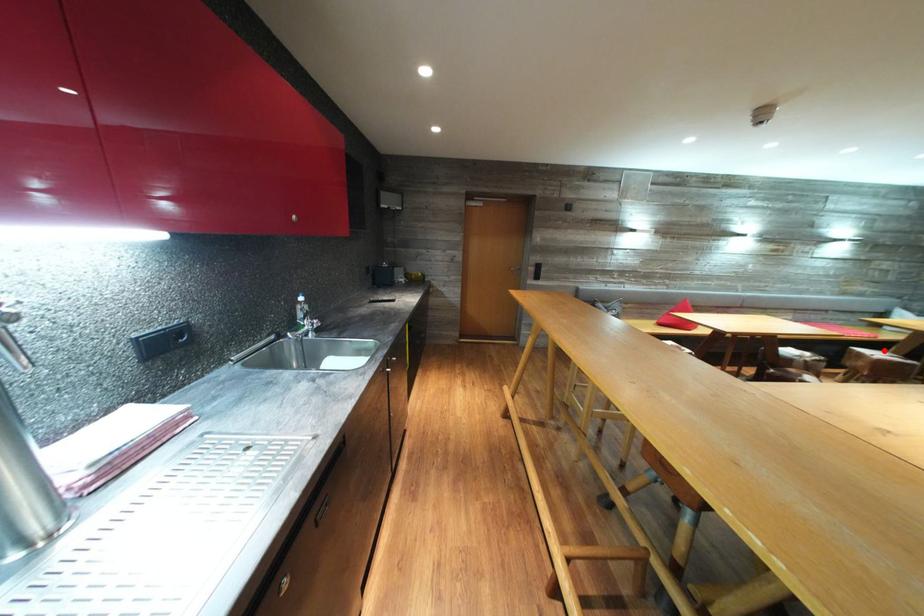
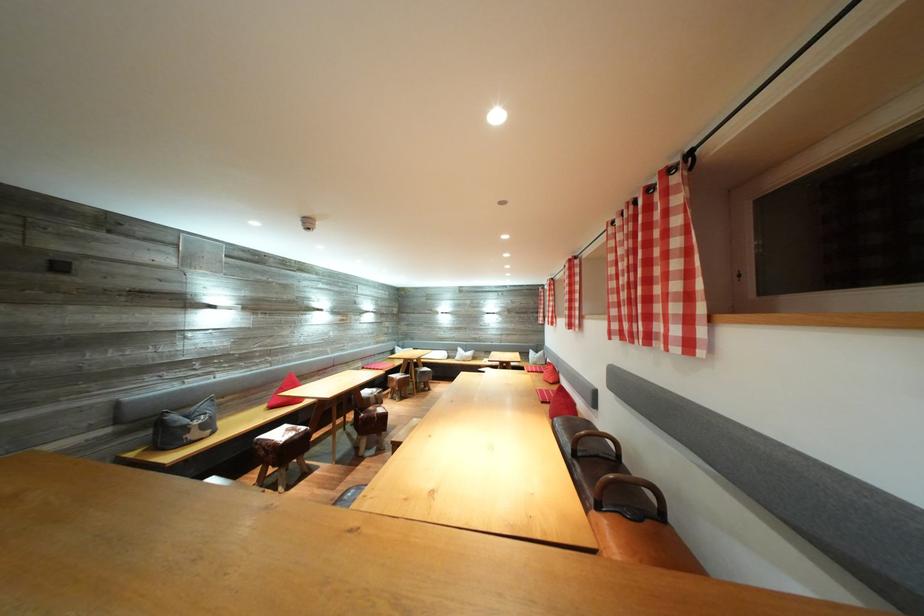
Question: A red point is marked in image1. In image2, is the corresponding 3D point closer to the camera or farther? Reply with the corresponding letter.

Choices:
 (A) The corresponding 3D point is closer.
 (B) The corresponding 3D point is farther.

Answer: (A)